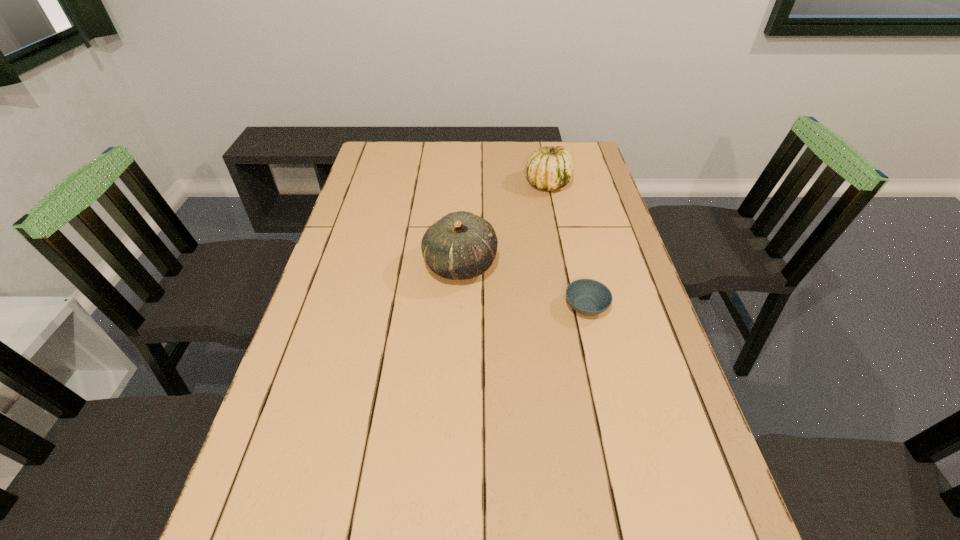
Where is `the nearer gourd`? This screenshot has height=540, width=960. the nearer gourd is located at coordinates (461, 245).

Where is `the leftmost object`? The width and height of the screenshot is (960, 540). the leftmost object is located at coordinates (461, 245).

The width and height of the screenshot is (960, 540). Find the location of `the shorter gourd`. the shorter gourd is located at coordinates pyautogui.click(x=549, y=168).

Locate an element on the screen. the second tallest object is located at coordinates (549, 168).

Where is `the shortest object`? the shortest object is located at coordinates (588, 297).

Where is `free region located 0.110m on the front of the nearer gourd`? This screenshot has width=960, height=540. free region located 0.110m on the front of the nearer gourd is located at coordinates (457, 324).

Identify the location of blank area located on the left of the farthest object. The image size is (960, 540). (482, 183).

Find the location of a particular element. The image size is (960, 540). vacant point located on the right of the shortest object is located at coordinates (628, 306).

Locate an element on the screen. The width and height of the screenshot is (960, 540). object present at the far edge is located at coordinates (549, 168).

Where is `gourd present at the right edge`? gourd present at the right edge is located at coordinates (549, 168).